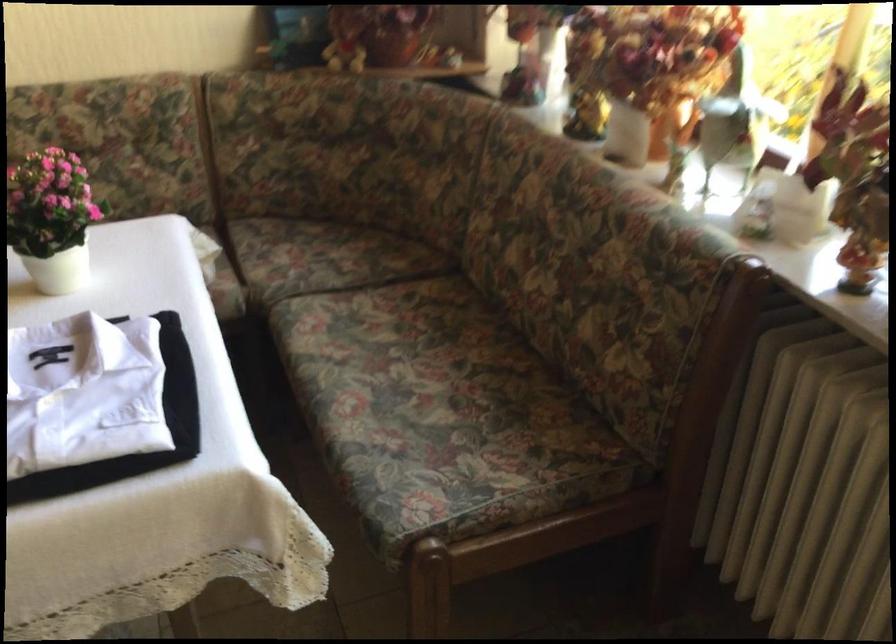
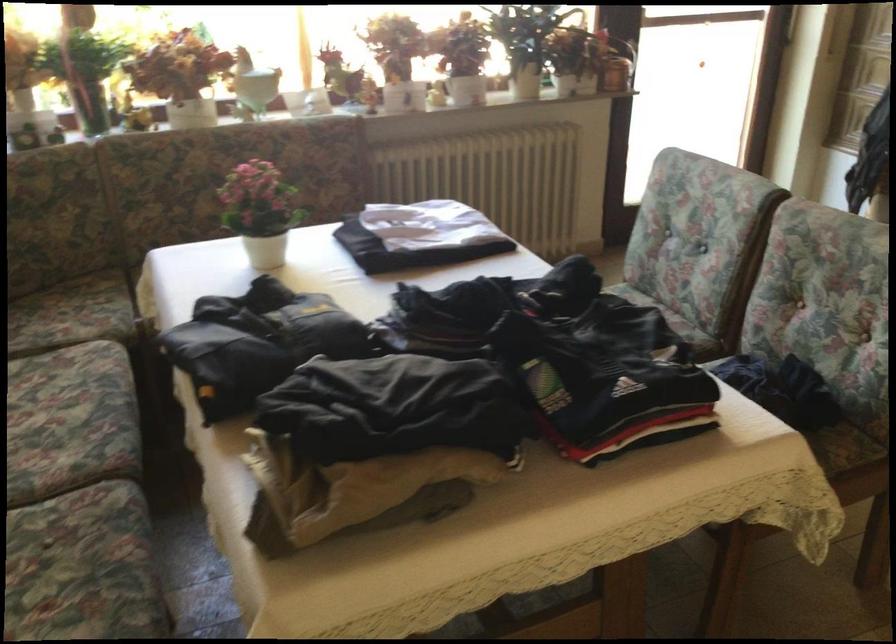
In the second image, find the point that corresponds to the point at 535,79 in the first image.

(93, 114)